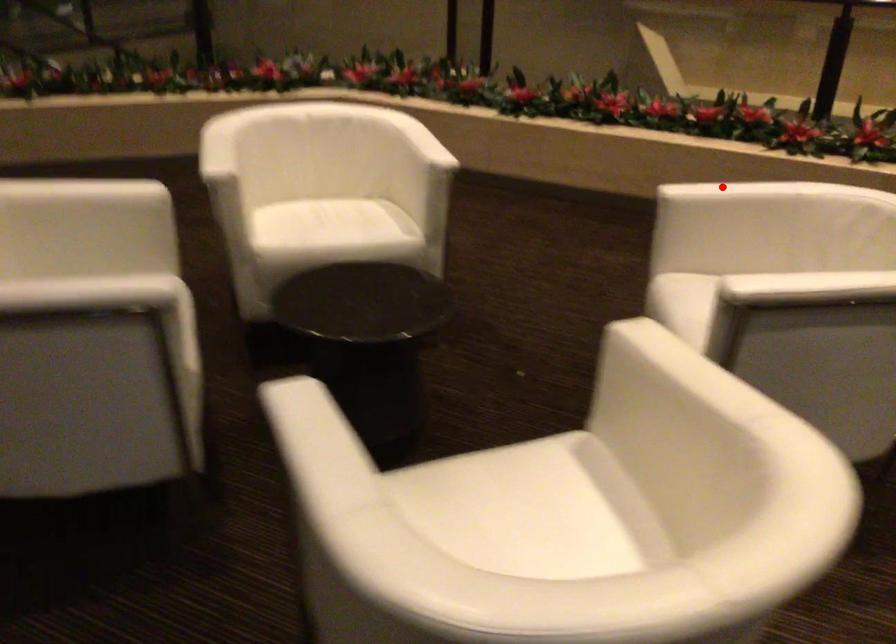
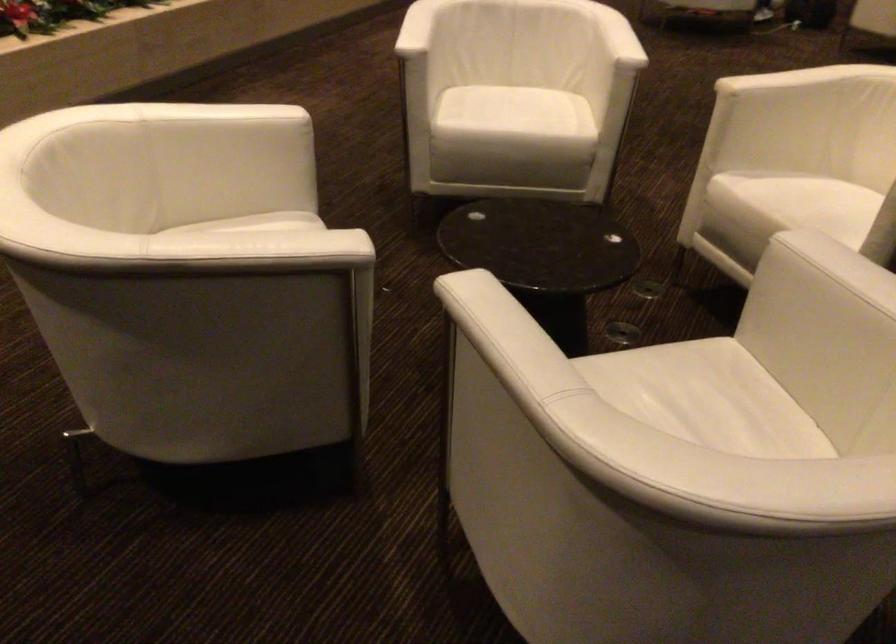
Question: I am providing you with two images of the same scene from different viewpoints. In image1, a red point is highlighted. Considering the same 3D point in image2, which of the following is correct?

Choices:
 (A) It is closer
 (B) It is farther

Answer: (B)